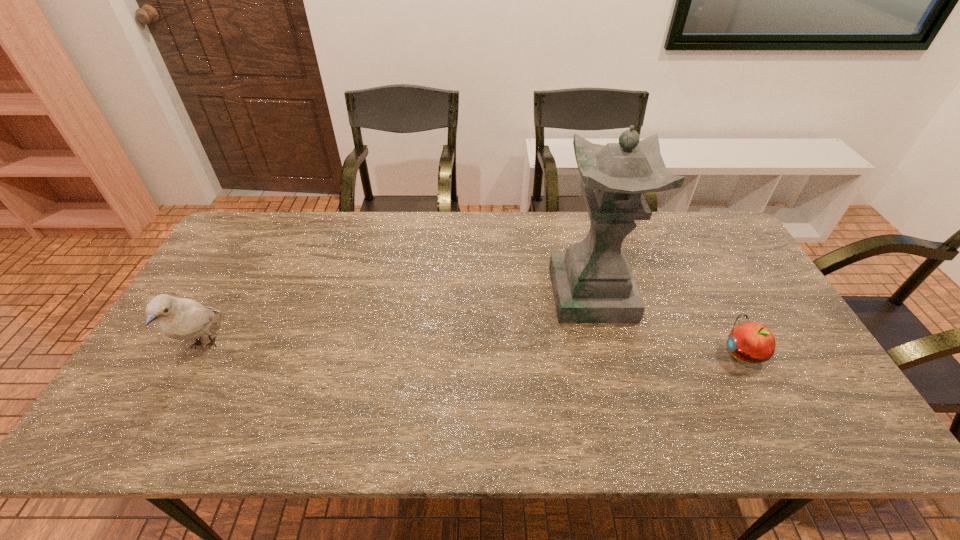
In order to click on vacant area between the apple and the sculpture in this screenshot , I will do `click(667, 324)`.

You are a GUI agent. You are given a task and a screenshot of the screen. Output one action in this format:
    pyautogui.click(x=<x>, y=<y>)
    Task: Click on the free point between the sculpture and the leftmost object
    
    Given the screenshot: What is the action you would take?
    pyautogui.click(x=398, y=320)

This screenshot has width=960, height=540. Find the location of `unoccupied area between the tallest object and the shortest object`. unoccupied area between the tallest object and the shortest object is located at coordinates (667, 324).

Locate an element on the screen. Image resolution: width=960 pixels, height=540 pixels. free space between the second shortest object and the rightmost object is located at coordinates (473, 349).

Find the location of a particular element. free space between the sculpture and the second shortest object is located at coordinates (398, 320).

The image size is (960, 540). Find the location of `free area in between the leftmost object and the apple`. free area in between the leftmost object and the apple is located at coordinates (473, 349).

I want to click on free spot between the rightmost object and the second tallest object, so click(473, 349).

The width and height of the screenshot is (960, 540). What are the coordinates of `vacant area that lies between the bird and the sculpture` in the screenshot? It's located at (398, 320).

Find the location of `free space between the shortest object and the second object from right to left`. free space between the shortest object and the second object from right to left is located at coordinates (667, 324).

In order to click on object that stands as the closest to the apple in this screenshot , I will do `click(592, 282)`.